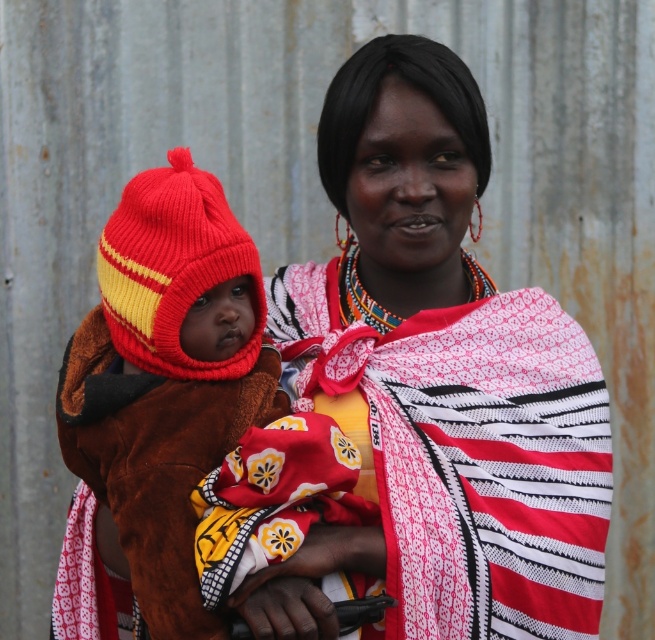
You are an artist trying to sketch the scene. You need to decide the order of drawing layers. Which point should you draw first, point (417, 376) or point (159, 604)?

Point (159, 604) should be drawn first because it is in front of point (417, 376).